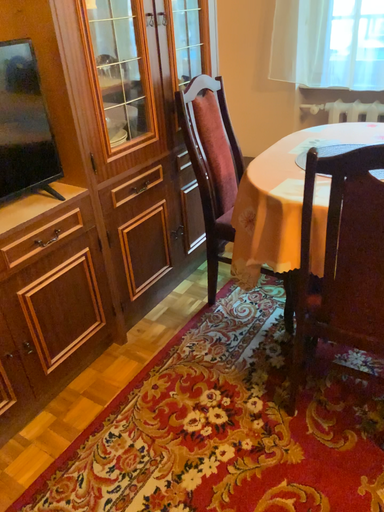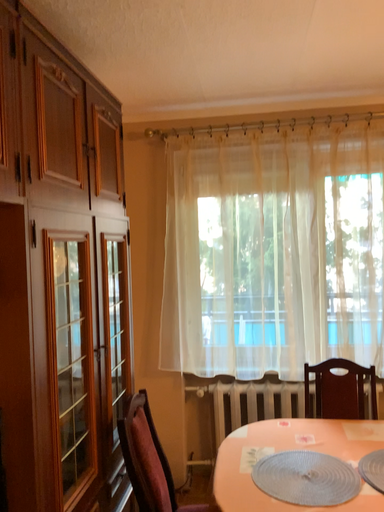
Question: How did the camera likely rotate when shooting the video?

Choices:
 (A) rotated upward
 (B) rotated downward

Answer: (A)